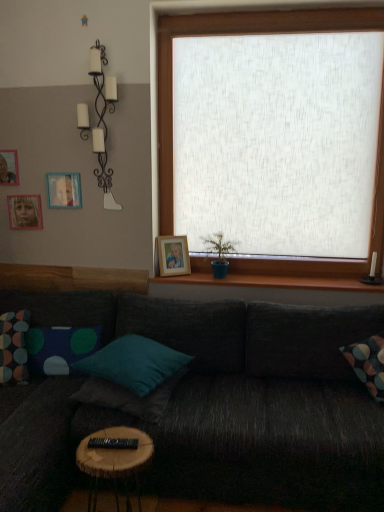
Find the location of a particular element. dark gray fabric couch at center is located at coordinates (212, 406).

What do you see at coordinates (212, 406) in the screenshot? This screenshot has height=512, width=384. I see `dark gray fabric couch at center` at bounding box center [212, 406].

Describe the element at coordinates (133, 362) in the screenshot. I see `teal fabric pillow at center, the third pillow from the left` at that location.

I want to click on wooden round table at lower center, so click(x=115, y=458).

Does point (151, 410) appear closer or farther from the camera than point (100, 55)?

Point (151, 410) is closer to the camera than point (100, 55).

Is teal fabric pillow at center, which is the 4th pillow from left to right, positioned with its back to white matte candle holder at upper left?

No, white matte candle holder at upper left is not at the back of teal fabric pillow at center, which is the 4th pillow from left to right.

How many degrees apart are the facing directions of teal fabric pillow at center, marked as the first pillow in a right-to-left arrangement, and white matte candle holder at upper left?

81 degrees separate the facing orientations of teal fabric pillow at center, marked as the first pillow in a right-to-left arrangement, and white matte candle holder at upper left.

Locate an element on the screen. The image size is (384, 512). lamp behind the polka dot fabric pillow at left, which ranks as the third pillow in right-to-left order is located at coordinates (100, 120).

Are white matte candle holder at upper left and polka dot fabric pillow at left, the 2th pillow positioned from the left, beside each other?

white matte candle holder at upper left and polka dot fabric pillow at left, the 2th pillow positioned from the left, are clearly separated.

Considering the points (104, 94) and (44, 329), which point is in front, point (104, 94) or point (44, 329)?

Point (44, 329)

Is wooden picture frame at upper left, which is the third picture frame from left to right, in front of or behind multicolored fabric pillow at left, which is the fourth pillow in right-to-left order, in the image?

wooden picture frame at upper left, which is the third picture frame from left to right, is behind multicolored fabric pillow at left, which is the fourth pillow in right-to-left order.

From a real-world perspective, is wooden picture frame at upper left, which is the third picture frame from left to right, on multicolored fabric pillow at left, which is the fourth pillow in right-to-left order?

Yes.

Between wooden picture frame at upper left, which is the third picture frame from left to right, and multicolored fabric pillow at left, the 1th pillow viewed from the left, which one has less height?

With less height is wooden picture frame at upper left, which is the third picture frame from left to right.

How distant is dark gray fabric couch at center from wooden picture frame at upper left, which is the 2th picture frame in right-to-left order?

The distance of dark gray fabric couch at center from wooden picture frame at upper left, which is the 2th picture frame in right-to-left order, is 1.38 meters.

From a real-world perspective, is dark gray fabric couch at center physically located above or below wooden picture frame at upper left, marked as the 2th picture frame in a top-to-bottom arrangement?

In terms of real-world spatial position, dark gray fabric couch at center is below wooden picture frame at upper left, marked as the 2th picture frame in a top-to-bottom arrangement.

Are dark gray fabric couch at center and wooden picture frame at upper left, which is the third picture frame from left to right, far apart?

Absolutely, dark gray fabric couch at center is distant from wooden picture frame at upper left, which is the third picture frame from left to right.

How many degrees apart are the facing directions of dark gray fabric couch at center and wooden picture frame at upper left, marked as the 2th picture frame in a top-to-bottom arrangement?

1.02 degrees separate the facing orientations of dark gray fabric couch at center and wooden picture frame at upper left, marked as the 2th picture frame in a top-to-bottom arrangement.

Is matte wooden picture frame at upper left, which is counted as the 3th picture frame, starting from the top, not within multicolored fabric pillow at left, the 1th pillow viewed from the left?

Yes, matte wooden picture frame at upper left, which is counted as the 3th picture frame, starting from the top, is outside of multicolored fabric pillow at left, the 1th pillow viewed from the left.

Considering the positions of point (39, 213) and point (27, 374), is point (39, 213) closer or farther from the camera than point (27, 374)?

Point (39, 213) appears to be farther away from the viewer than point (27, 374).

Identify the location of the 2nd pillow in front of the matte wooden picture frame at upper left, the second picture frame in the bottom-to-top sequence, counting from the anchor's position. (13, 347).

From the image's perspective, between matte wooden picture frame at upper left, which is counted as the 3th picture frame, starting from the top, and multicolored fabric pillow at left, which is the fourth pillow in right-to-left order, who is located below?

From the image's view, multicolored fabric pillow at left, which is the fourth pillow in right-to-left order, is below.

Does teal fabric pillow at center, which is the 4th pillow from left to right, have a greater width compared to polka dot fabric pillow at left, the 2th pillow positioned from the left?

Yes.

Is point (168, 399) more distant than point (47, 338)?

No, (168, 399) is closer to viewer.

Can you see teal fabric pillow at center, marked as the first pillow in a right-to-left arrangement, touching polka dot fabric pillow at left, the 2th pillow positioned from the left?

teal fabric pillow at center, marked as the first pillow in a right-to-left arrangement, is not next to polka dot fabric pillow at left, the 2th pillow positioned from the left, and they're not touching.

Is polka dot fabric pillow at left, the 2th pillow positioned from the left, not inside matte wooden picture frame at upper left, which is counted as the 3th picture frame, starting from the top?

That's correct, polka dot fabric pillow at left, the 2th pillow positioned from the left, is outside of matte wooden picture frame at upper left, which is counted as the 3th picture frame, starting from the top.

Between polka dot fabric pillow at left, which ranks as the third pillow in right-to-left order, and matte wooden picture frame at upper left, which is counted as the 3th picture frame, starting from the top, which one is positioned in front?

polka dot fabric pillow at left, which ranks as the third pillow in right-to-left order, is more forward.

Can you confirm if polka dot fabric pillow at left, the 2th pillow positioned from the left, is shorter than matte wooden picture frame at upper left, which is counted as the 3th picture frame, starting from the top?

No.

Is polka dot fabric pillow at left, the 2th pillow positioned from the left, beside matte wooden picture frame at upper left, which is counted as the 3th picture frame, starting from the top?

polka dot fabric pillow at left, the 2th pillow positioned from the left, is not next to matte wooden picture frame at upper left, which is counted as the 3th picture frame, starting from the top, and they're not touching.

This screenshot has width=384, height=512. In order to click on pillow that is the 4th one when counting downward from the white matte candle holder at upper left (from the image's perspective) in this screenshot , I will do `click(129, 397)`.

I want to click on lamp lying behind the polka dot fabric pillow at left, the 2th pillow positioned from the left, so click(x=100, y=120).

Estimate the real-world distances between objects in this image. Which object is closer to teal fabric pillow at center, the third pillow from the left, green matte plant at center or wooden picture frame at upper left, which is the fourth picture frame in bottom-to-top order?

green matte plant at center is positioned closer to the anchor teal fabric pillow at center, the third pillow from the left.

Estimate the real-world distances between objects in this image. Which object is further from wooden picture frame at center, which is the fourth picture frame in top-to-bottom order, wooden picture frame at upper left, which is the 1th picture frame in top-to-bottom order, or matte wooden picture frame at upper left, which is counted as the 3th picture frame, starting from the top?

Among the two, wooden picture frame at upper left, which is the 1th picture frame in top-to-bottom order, is located further to wooden picture frame at center, which is the fourth picture frame in top-to-bottom order.

When comparing their distances from wooden picture frame at upper left, which is the third picture frame from left to right, does white matte candle holder at upper left or wooden picture frame at upper left, placed as the fourth picture frame when sorted from right to left, seem further?

white matte candle holder at upper left is further to wooden picture frame at upper left, which is the third picture frame from left to right.

When comparing their distances from wooden picture frame at center, which is the fourth picture frame in top-to-bottom order, does teal fabric pillow at center, marked as the first pillow in a right-to-left arrangement, or white matte candle holder at upper left seem further?

teal fabric pillow at center, marked as the first pillow in a right-to-left arrangement, is positioned further to the anchor wooden picture frame at center, which is the fourth picture frame in top-to-bottom order.

Considering their positions, is wooden round table at lower center positioned closer to wooden picture frame at upper left, which is the 2th picture frame in right-to-left order, than green matte plant at center?

green matte plant at center is closer to wooden picture frame at upper left, which is the 2th picture frame in right-to-left order.

Based on the photo, from the image, which object appears to be nearer to dark gray fabric couch at center, white matte candle holder at upper left or wooden picture frame at upper left, marked as the 2th picture frame in a top-to-bottom arrangement?

Among the two, white matte candle holder at upper left is located nearer to dark gray fabric couch at center.

Which object lies further to the anchor point wooden at lower center, polka dot fabric pillow at left, which ranks as the third pillow in right-to-left order, or wooden picture frame at center, which is the fourth picture frame in top-to-bottom order?

Based on the image, polka dot fabric pillow at left, which ranks as the third pillow in right-to-left order, appears to be further to wooden at lower center.

Based on their spatial positions, is dark gray fabric couch at center or polka dot fabric pillow at left, which ranks as the third pillow in right-to-left order, closer to green matte plant at center?

The object closer to green matte plant at center is dark gray fabric couch at center.

In order to click on houseplant that lies between white matte candle holder at upper left and multicolored fabric pillow at left, which is the fourth pillow in right-to-left order, from top to bottom in this screenshot , I will do `click(219, 253)`.

The image size is (384, 512). In order to click on pillow between multicolored fabric pillow at left, which is the fourth pillow in right-to-left order, and teal fabric pillow at center, the third pillow from the left in this screenshot , I will do `click(60, 348)`.

I want to click on pillow between wooden picture frame at upper left, which is the third picture frame from left to right, and polka dot fabric pillow at left, which ranks as the third pillow in right-to-left order, vertically, so click(13, 347).

Locate an element on the screen. This screenshot has width=384, height=512. studio couch between wooden round table at lower center and wooden at lower center in the front-back direction is located at coordinates (212, 406).